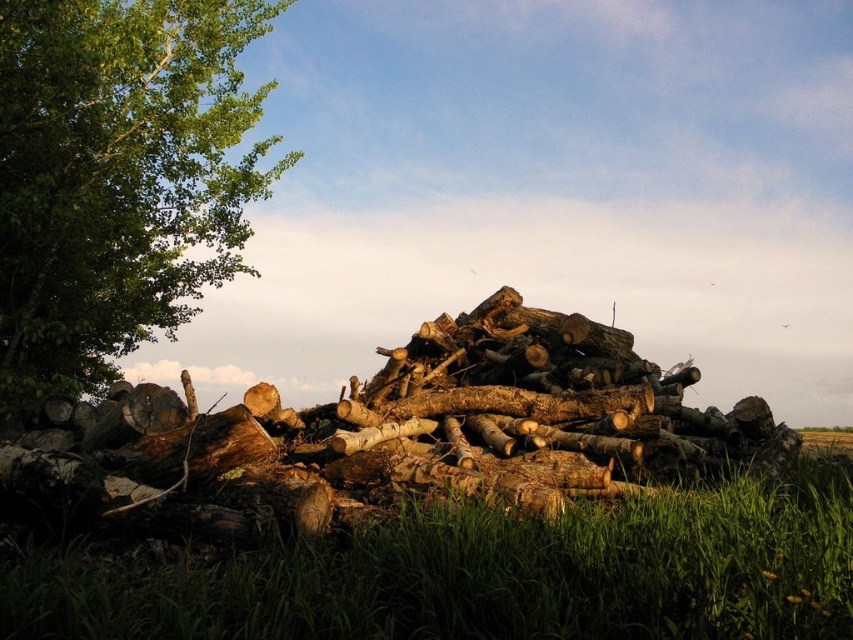
Question: Which object appears closest to the camera in this image?

Choices:
 (A) green leafy tree at left
 (B) green grass at lower center

Answer: (B)

Question: Is green grass at lower center further to the viewer compared to green leafy tree at left?

Choices:
 (A) yes
 (B) no

Answer: (B)

Question: Which point is farther to the camera?

Choices:
 (A) green leafy tree at left
 (B) green grass at lower center

Answer: (A)

Question: Is green grass at lower center below green leafy tree at left?

Choices:
 (A) yes
 (B) no

Answer: (A)

Question: Is green grass at lower center positioned before green leafy tree at left?

Choices:
 (A) yes
 (B) no

Answer: (A)